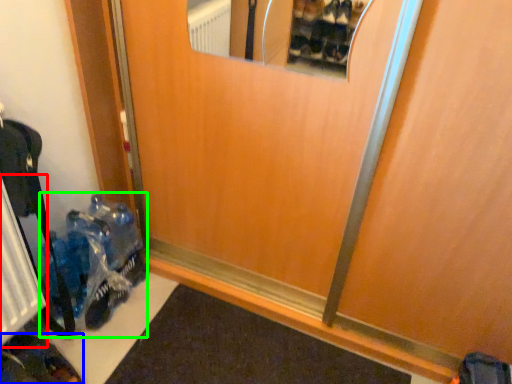
Question: Which object is positioned closest to radiator (highlighted by a red box)? Select from footwear (highlighted by a blue box) and toy (highlighted by a green box).

Choices:
 (A) footwear
 (B) toy

Answer: (B)